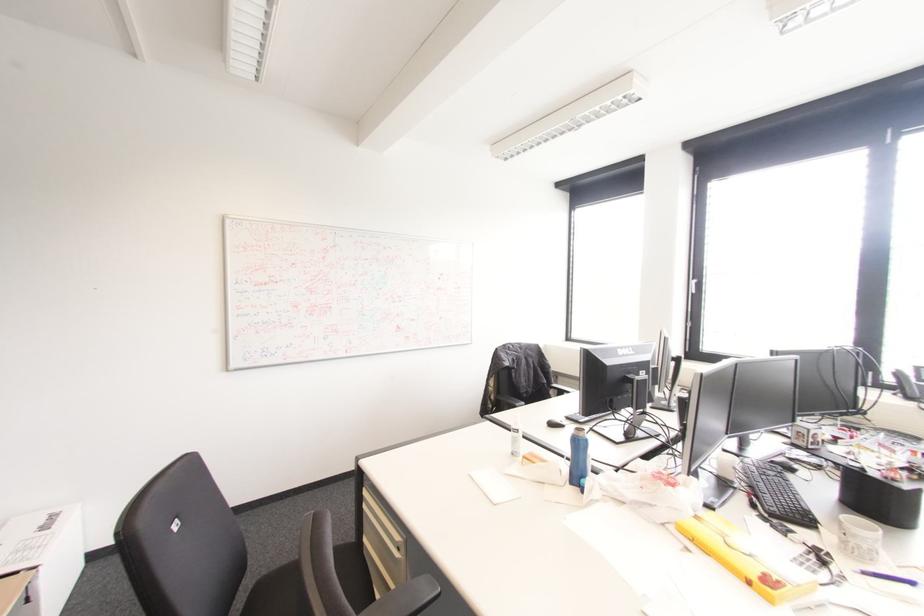
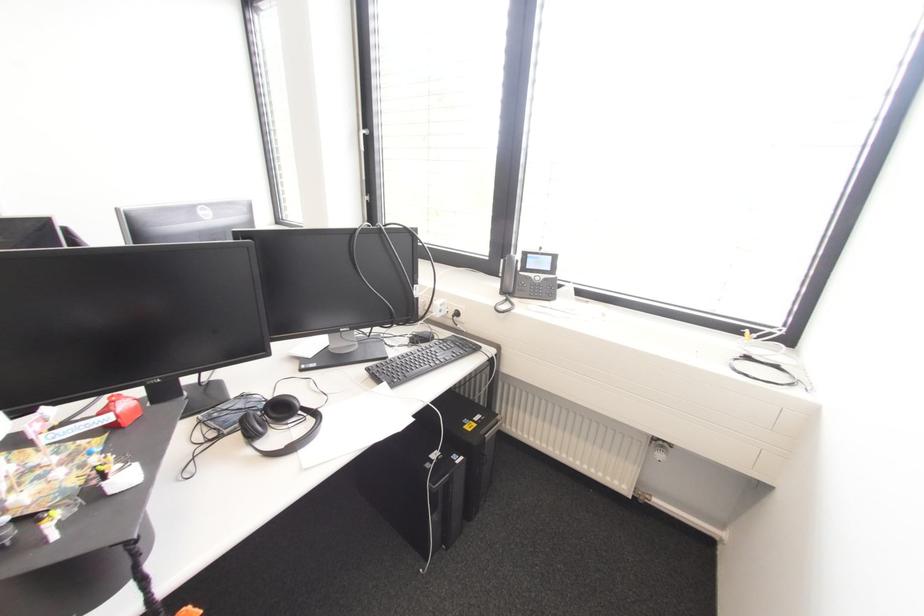
The point at (694,281) is marked in the first image. Where is the corresponding point in the second image?

(361, 132)